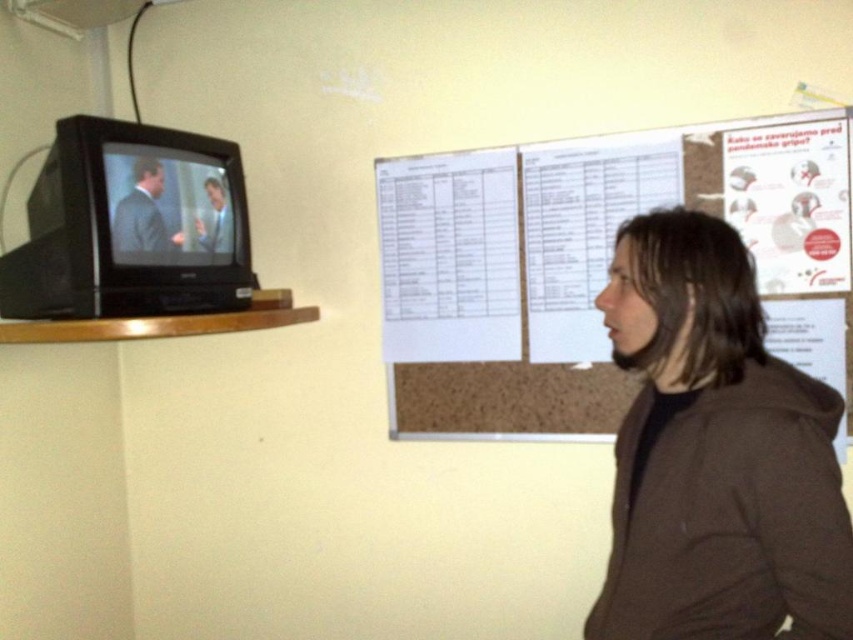
Is matte black suit at upper left shorter than smooth skin man at upper left?

Incorrect, matte black suit at upper left's height does not fall short of smooth skin man at upper left's.

Which is below, matte black suit at upper left or smooth skin man at upper left?

matte black suit at upper left

Between point (154, 232) and point (221, 193), which one is positioned behind?

The point (221, 193) is more distant.

Identify the location of matte black suit at upper left. (143, 214).

Is brown matte jacket at center below smooth skin man at upper left?

Yes, brown matte jacket at center is below smooth skin man at upper left.

Between point (730, 276) and point (196, 224), which one is positioned in front?

Point (730, 276) is more forward.

Does point (776, 452) come behind point (225, 200)?

No, (776, 452) is closer to viewer.

This screenshot has width=853, height=640. In order to click on brown matte jacket at center in this screenshot , I will do `click(715, 452)`.

From the picture: Who is higher up, brown matte jacket at center or matte black suit at upper left?

matte black suit at upper left is above.

The width and height of the screenshot is (853, 640). What do you see at coordinates (715, 452) in the screenshot?
I see `brown matte jacket at center` at bounding box center [715, 452].

Is point (728, 312) positioned behind point (119, 204)?

No, (728, 312) is closer to viewer.

Locate an element on the screen. The image size is (853, 640). brown matte jacket at center is located at coordinates (715, 452).